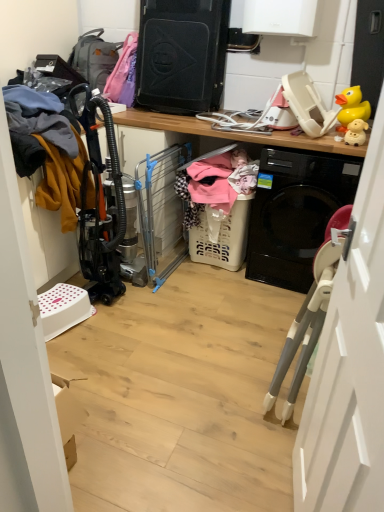
At what (x,y) coordinates should I click in order to perform the action: click on matte gray backpack at upper left. Please return your answer as a coordinate pair (x, y). This screenshot has height=512, width=384. Looking at the image, I should click on (94, 58).

This screenshot has width=384, height=512. What are the coordinates of `black plastic speaker at upper center` in the screenshot? It's located at (181, 55).

This screenshot has width=384, height=512. What do you see at coordinates (181, 55) in the screenshot?
I see `black plastic speaker at upper center` at bounding box center [181, 55].

This screenshot has height=512, width=384. I want to click on white plastic door at right, so click(350, 365).

Describe the element at coordinates (351, 106) in the screenshot. I see `yellow rubber duck at upper right, arranged as the first toy when viewed from the back` at that location.

What do you see at coordinates (223, 238) in the screenshot?
I see `white plastic laundry basket at center` at bounding box center [223, 238].

I want to click on matte gray backpack at upper left, so click(94, 58).

Is white plastic door at right smaller than yellow fleece jacket at left, placed as the 1th clothing when sorted from left to right?

Indeed, white plastic door at right has a smaller size compared to yellow fleece jacket at left, placed as the 1th clothing when sorted from left to right.

Can you confirm if white plastic door at right is positioned to the right of yellow fleece jacket at left, acting as the 2th clothing starting from the right?

Yes.

Does white plastic door at right contain yellow fleece jacket at left, acting as the 2th clothing starting from the right?

That's incorrect, yellow fleece jacket at left, acting as the 2th clothing starting from the right, is not inside white plastic door at right.

Which object is closer to the camera, white plastic door at right or yellow fleece jacket at left, acting as the 2th clothing starting from the right?

white plastic door at right is in front.

Between soft pink fabric at center, which appears as the 2th clothing when viewed from the left, and yellow rubber toy at upper right, the 1th toy when ordered from bottom to top, which one has larger size?

soft pink fabric at center, which appears as the 2th clothing when viewed from the left.

From a real-world perspective, is soft pink fabric at center, which appears as the 2th clothing when viewed from the left, physically located above or below yellow rubber toy at upper right, the 2th toy when ordered from back to front?

soft pink fabric at center, which appears as the 2th clothing when viewed from the left, is situated lower than yellow rubber toy at upper right, the 2th toy when ordered from back to front, in the real world.

There is a soft pink fabric at center, the 1th clothing viewed from the right. In order to click on the 1st toy above it (from a real-world perspective) in this screenshot , I will do `click(356, 132)`.

Which point is more distant from viewer, (201, 197) or (347, 142)?

The point (201, 197) is behind.

From a real-world perspective, is matte gray backpack at upper left positioned above or below white plastic laundry basket at center?

matte gray backpack at upper left is situated higher than white plastic laundry basket at center in the real world.

Where is `computer desk below the matte gray backpack at upper left (from a real-world perspective)`? Image resolution: width=384 pixels, height=512 pixels. computer desk below the matte gray backpack at upper left (from a real-world perspective) is located at coordinates click(x=232, y=133).

Is matte gray backpack at upper left placed right next to white plastic laundry basket at center?

A: No.

Considering the positions of points (90, 76) and (348, 152), is point (90, 76) farther from camera compared to point (348, 152)?

Yes, it is behind point (348, 152).

Is matte gray backpack at upper left looking in the opposite direction of soft pink fabric at center, which appears as the 2th clothing when viewed from the left?

matte gray backpack at upper left does not have its back to soft pink fabric at center, which appears as the 2th clothing when viewed from the left.

Identify the location of backpack that appears above the soft pink fabric at center, the 1th clothing viewed from the right (from the image's perspective). (94, 58).

From the image's perspective, who appears lower, matte gray backpack at upper left or soft pink fabric at center, which appears as the 2th clothing when viewed from the left?

soft pink fabric at center, which appears as the 2th clothing when viewed from the left, is shown below in the image.

Considering the points (85, 67) and (191, 170), which point is behind, point (85, 67) or point (191, 170)?

The point (85, 67) is farther from the camera.

From a real-world perspective, is white plastic door at right above or below yellow rubber toy at upper right, the 2th toy when ordered from back to front?

white plastic door at right is below yellow rubber toy at upper right, the 2th toy when ordered from back to front.

Considering the points (345, 422) and (360, 130), which point is in front, point (345, 422) or point (360, 130)?

The point (345, 422) is closer to the camera.

How much distance is there between white plastic door at right and yellow rubber toy at upper right, the 1th toy when ordered from bottom to top?

1.45 meters.

Is white plastic door at right positioned with its back to yellow rubber toy at upper right, the second toy positioned from the top?

No, yellow rubber toy at upper right, the second toy positioned from the top, is not at the back of white plastic door at right.

From a real-world perspective, is white plastic laundry basket at center under soft pink fabric at center, which appears as the 2th clothing when viewed from the left?

Yes, from a real-world perspective, white plastic laundry basket at center is beneath soft pink fabric at center, which appears as the 2th clothing when viewed from the left.

Based on their sizes in the image, would you say white plastic laundry basket at center is bigger or smaller than soft pink fabric at center, the 1th clothing viewed from the right?

white plastic laundry basket at center is smaller than soft pink fabric at center, the 1th clothing viewed from the right.

Can we say white plastic laundry basket at center lies outside soft pink fabric at center, which appears as the 2th clothing when viewed from the left?

No, most part of white plastic laundry basket at center lies within soft pink fabric at center, which appears as the 2th clothing when viewed from the left.

At what (x,y) coordinates should I click in order to perform the action: click on basket lying behind the soft pink fabric at center, the 1th clothing viewed from the right. Please return your answer as a coordinate pair (x, y). Looking at the image, I should click on [x=223, y=238].

Visually, is soft pink fabric at center, the 1th clothing viewed from the right, positioned to the left or to the right of black plastic speaker at upper center?

soft pink fabric at center, the 1th clothing viewed from the right, is positioned on black plastic speaker at upper center's right side.

You are a GUI agent. You are given a task and a screenshot of the screen. Output one action in this format:
    pyautogui.click(x=<x>, y=<y>)
    Task: Click on the appliance behind the soft pink fabric at center, the 1th clothing viewed from the right
    
    Given the screenshot: What is the action you would take?
    click(181, 55)

Consider the image. Could you tell me if soft pink fabric at center, the 1th clothing viewed from the right, is facing black plastic speaker at upper center?

No.

Starting from the white plastic door at right, which clothing is the 2nd one to the left? Please provide its 2D coordinates.

[(58, 69)]

This screenshot has height=512, width=384. Find the location of `toy that is the 1st object located above the soft pink fabric at center, the 1th clothing viewed from the right (from the image's perspective)`. toy that is the 1st object located above the soft pink fabric at center, the 1th clothing viewed from the right (from the image's perspective) is located at coordinates (356, 132).

Considering their positions, is white plastic laundry basket at center positioned closer to yellow fleece jacket at left, placed as the 1th clothing when sorted from left to right, than soft pink fabric at center, the 1th clothing viewed from the right?

soft pink fabric at center, the 1th clothing viewed from the right.

When comparing their distances from soft pink fabric at center, the 1th clothing viewed from the right, does matte gray backpack at upper left or yellow rubber toy at upper right, the 2th toy when ordered from back to front, seem further?

matte gray backpack at upper left lies further to soft pink fabric at center, the 1th clothing viewed from the right, than the other object.

From the image, which object appears to be nearer to white plastic laundry basket at center, white plastic laundry basket at center or yellow rubber duck at upper right, arranged as the first toy when viewed from the back?

The object closer to white plastic laundry basket at center is yellow rubber duck at upper right, arranged as the first toy when viewed from the back.

Which object lies nearer to the anchor point white plastic laundry basket at center, yellow rubber duck at upper right, arranged as the first toy when viewed from the back, or soft pink fabric at center, the 1th clothing viewed from the right?

Based on the image, soft pink fabric at center, the 1th clothing viewed from the right, appears to be nearer to white plastic laundry basket at center.

Estimate the real-world distances between objects in this image. Which object is further from matte gray backpack at upper left, yellow rubber duck at upper right, the first toy when ordered from top to bottom, or soft pink fabric at center, the 1th clothing viewed from the right?

yellow rubber duck at upper right, the first toy when ordered from top to bottom, is positioned further to the anchor matte gray backpack at upper left.

Looking at the image, which one is located further to black plastic speaker at upper center, yellow fleece jacket at left, acting as the 2th clothing starting from the right, or yellow rubber toy at upper right, the second toy positioned from the top?

yellow rubber toy at upper right, the second toy positioned from the top.

Based on the photo, based on their spatial positions, is white plastic door at right or yellow rubber duck at upper right, the 2th toy viewed from the front, closer to white plastic laundry basket at center?

yellow rubber duck at upper right, the 2th toy viewed from the front, is closer to white plastic laundry basket at center.

From the image, which object appears to be farther from yellow rubber duck at upper right, arranged as the first toy when viewed from the back, black plastic speaker at upper center or white plastic laundry basket at center?

Based on the image, black plastic speaker at upper center appears to be further to yellow rubber duck at upper right, arranged as the first toy when viewed from the back.

At what (x,y) coordinates should I click in order to perform the action: click on appliance between matte gray backpack at upper left and yellow rubber duck at upper right, the 2th toy viewed from the front, from left to right. Please return your answer as a coordinate pair (x, y). Looking at the image, I should click on (181, 55).

The width and height of the screenshot is (384, 512). Find the location of `backpack located between yellow fleece jacket at left, acting as the 2th clothing starting from the right, and white plastic laundry basket at center in the left-right direction`. backpack located between yellow fleece jacket at left, acting as the 2th clothing starting from the right, and white plastic laundry basket at center in the left-right direction is located at coordinates (94, 58).

Identify the location of toy between white plastic door at right and white plastic laundry basket at center in the front-back direction. The image size is (384, 512). (356, 132).

Where is `computer desk between black plastic speaker at upper center and white plastic laundry basket at center vertically`? computer desk between black plastic speaker at upper center and white plastic laundry basket at center vertically is located at coordinates (232, 133).